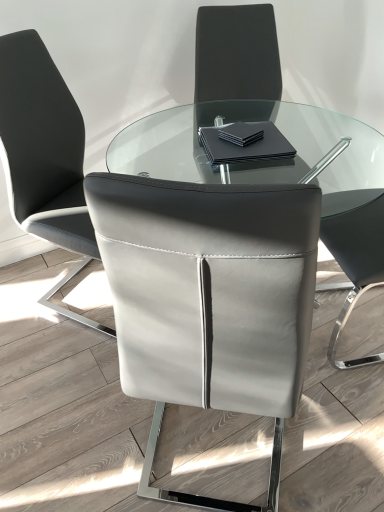
Question: Should I look upward or downward to see matte gray leather chair at center, which is counted as the 1th chair, starting from the right?

Choices:
 (A) down
 (B) up

Answer: (A)

Question: Does white leather chair at center, marked as the 2th chair in a right-to-left arrangement, have a greater width compared to matte gray leather chair at center, the 2th chair when ordered from left to right?

Choices:
 (A) no
 (B) yes

Answer: (A)

Question: Considering the relative sizes of white leather chair at center, marked as the 2th chair in a right-to-left arrangement, and matte gray leather chair at center, the 2th chair when ordered from left to right, in the image provided, is white leather chair at center, marked as the 2th chair in a right-to-left arrangement, smaller than matte gray leather chair at center, the 2th chair when ordered from left to right,?

Choices:
 (A) yes
 (B) no

Answer: (B)

Question: Is white leather chair at center, positioned as the first chair in left-to-right order, positioned before matte gray leather chair at center, which is counted as the 1th chair, starting from the right?

Choices:
 (A) no
 (B) yes

Answer: (A)

Question: Is white leather chair at center, positioned as the first chair in left-to-right order, to the left of matte gray leather chair at center, the 2th chair when ordered from left to right, from the viewer's perspective?

Choices:
 (A) yes
 (B) no

Answer: (A)

Question: Is white leather chair at center, marked as the 2th chair in a right-to-left arrangement, behind matte gray leather chair at center, the 2th chair when ordered from left to right?

Choices:
 (A) no
 (B) yes

Answer: (B)

Question: Is there a large distance between white leather chair at center, positioned as the first chair in left-to-right order, and matte gray leather chair at center, which is counted as the 1th chair, starting from the right?

Choices:
 (A) yes
 (B) no

Answer: (B)

Question: Is black matte napkin at center wider than matte gray leather chair at center, which is counted as the 1th chair, starting from the right?

Choices:
 (A) yes
 (B) no

Answer: (B)

Question: From the image's perspective, would you say black matte napkin at center is positioned over matte gray leather chair at center, which is counted as the 1th chair, starting from the right?

Choices:
 (A) no
 (B) yes

Answer: (B)

Question: Would you say black matte napkin at center contains matte gray leather chair at center, which is counted as the 1th chair, starting from the right?

Choices:
 (A) no
 (B) yes

Answer: (A)

Question: Is black matte napkin at center facing away from matte gray leather chair at center, which is counted as the 1th chair, starting from the right?

Choices:
 (A) no
 (B) yes

Answer: (A)

Question: Is black matte napkin at center at the right side of matte gray leather chair at center, the 2th chair when ordered from left to right?

Choices:
 (A) yes
 (B) no

Answer: (A)

Question: Is black matte napkin at center placed right next to matte gray leather chair at center, the 2th chair when ordered from left to right?

Choices:
 (A) no
 (B) yes

Answer: (A)

Question: From the image's perspective, would you say white leather chair at center, positioned as the first chair in left-to-right order, is shown under black matte napkin at center?

Choices:
 (A) yes
 (B) no

Answer: (A)